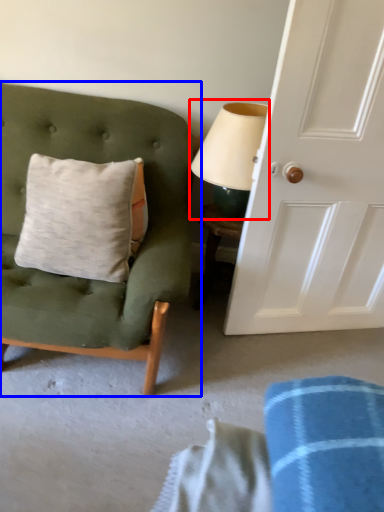
Question: Which object is further to the camera taking this photo, table lamp (highlighted by a red box) or chair (highlighted by a blue box)?

Choices:
 (A) table lamp
 (B) chair

Answer: (A)